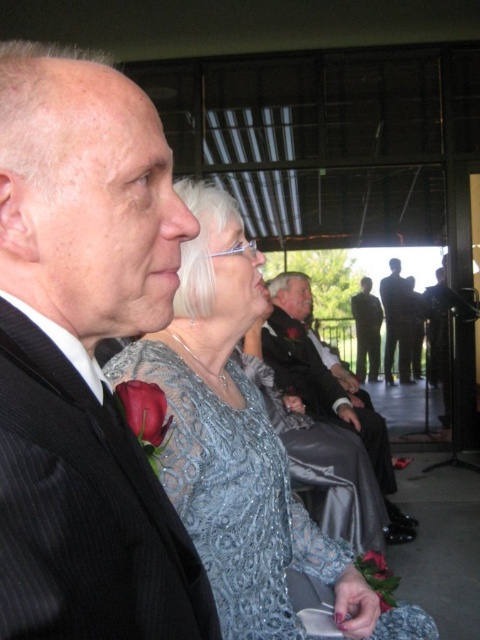
Question: Does silky black suit at center appear over translucent plastic glasses at upper center?

Choices:
 (A) yes
 (B) no

Answer: (B)

Question: Estimate the real-world distances between objects in this image. Which object is farther from the matte skin nose at center?

Choices:
 (A) black pinstripe suit at left
 (B) sparkly silver dress at center
 (C) silky black suit at center

Answer: (C)

Question: Considering the real-world distances, which object is farthest from the matte skin nose at center?

Choices:
 (A) silky black suit at center
 (B) black pinstripe suit at left
 (C) shiny black suit at center

Answer: (A)

Question: Among these points, which one is farthest from the camera?

Choices:
 (A) (179, 209)
 (B) (195, 416)

Answer: (B)

Question: Does silky black suit at center have a smaller size compared to dark gray suit at center?

Choices:
 (A) no
 (B) yes

Answer: (A)

Question: Observing the image, what is the correct spatial positioning of dark gray suit at center in reference to translucent plastic glasses at upper center?

Choices:
 (A) left
 (B) right

Answer: (B)